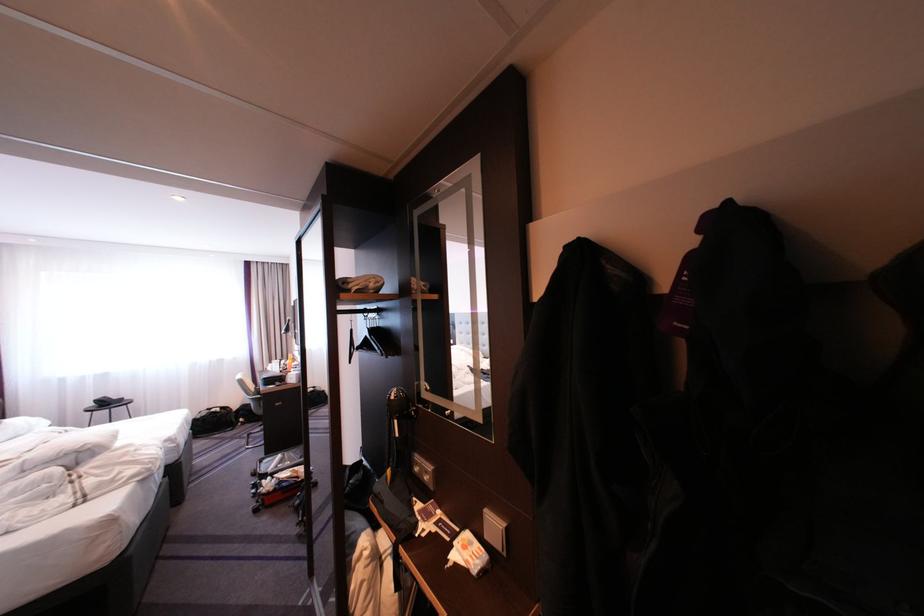
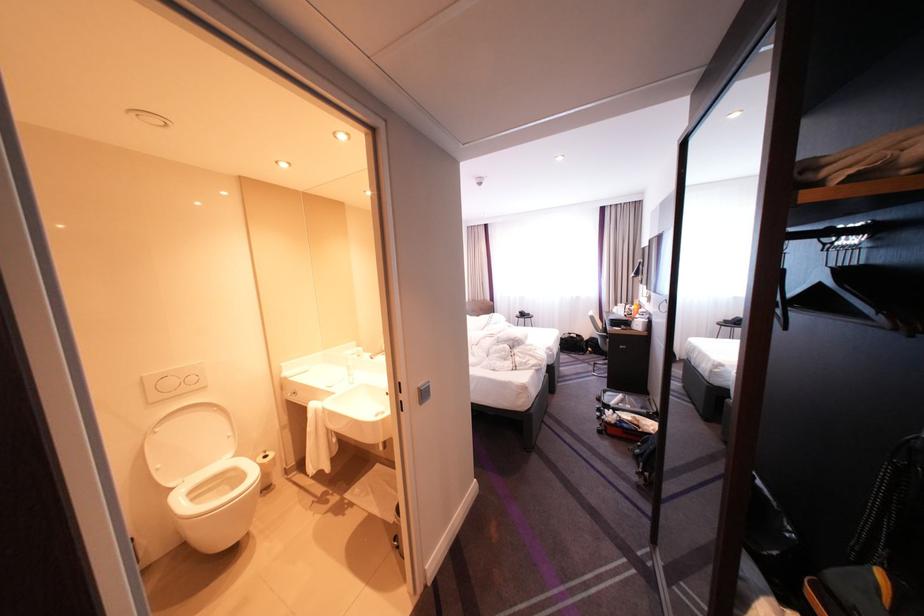
Where in the second image is the point corresponding to point (392, 493) from the first image?

(868, 610)